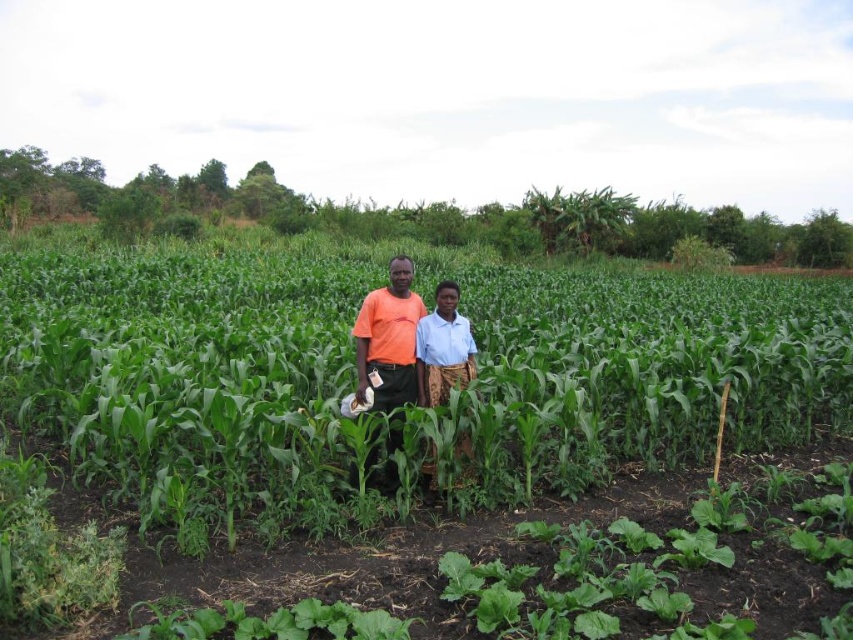
The image size is (853, 640). What do you see at coordinates (405, 408) in the screenshot?
I see `green leafy corn at center` at bounding box center [405, 408].

Looking at this image, does green leafy corn at center have a larger size compared to blue woven skirt at center?

Correct, green leafy corn at center is larger in size than blue woven skirt at center.

Is point (93, 326) less distant than point (438, 310)?

No, it is not.

In order to click on green leafy corn at center in this screenshot , I will do `click(405, 408)`.

Is point (102, 292) in front of point (442, 296)?

That is False.

Who is positioned more to the right, green leafy corn at center or orange cotton shirt at center?

green leafy corn at center

The image size is (853, 640). Identify the location of green leafy corn at center. (405, 408).

Image resolution: width=853 pixels, height=640 pixels. I want to click on green leafy corn at center, so click(x=405, y=408).

Who is more forward, (456, 355) or (468, 353)?

Positioned in front is point (456, 355).

Is point (393, 355) more distant than point (451, 305)?

No, (393, 355) is closer to viewer.

You are a GUI agent. You are given a task and a screenshot of the screen. Output one action in this format:
    pyautogui.click(x=<x>, y=<y>)
    Task: Click on the orange cotton shirt at center
    This screenshot has width=853, height=640.
    Given the screenshot: What is the action you would take?
    pyautogui.click(x=407, y=339)